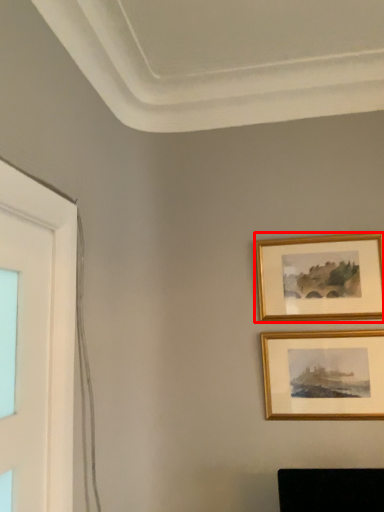
Question: From the image's perspective, where is picture frame (annotated by the red box) located in relation to picture frame in the image?

Choices:
 (A) above
 (B) below

Answer: (A)